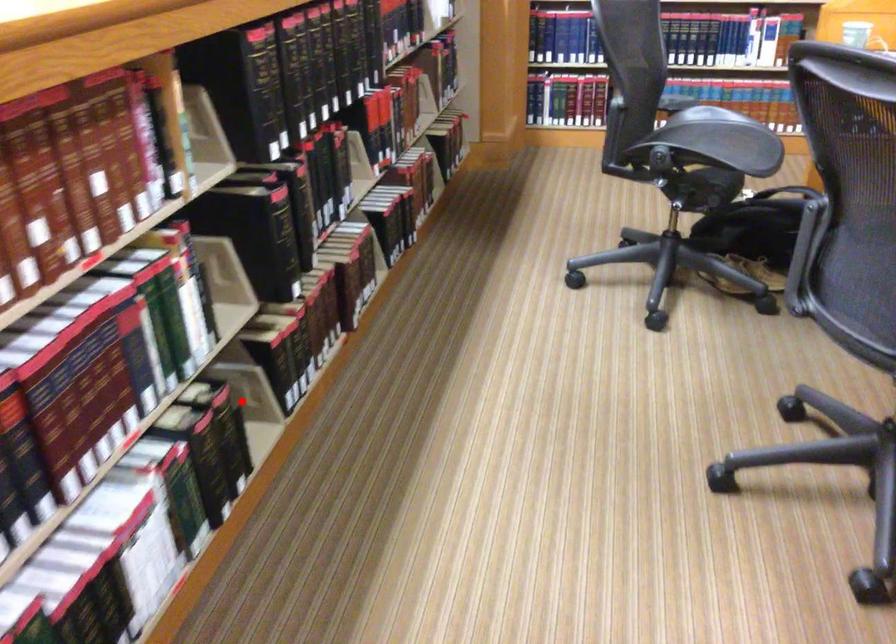
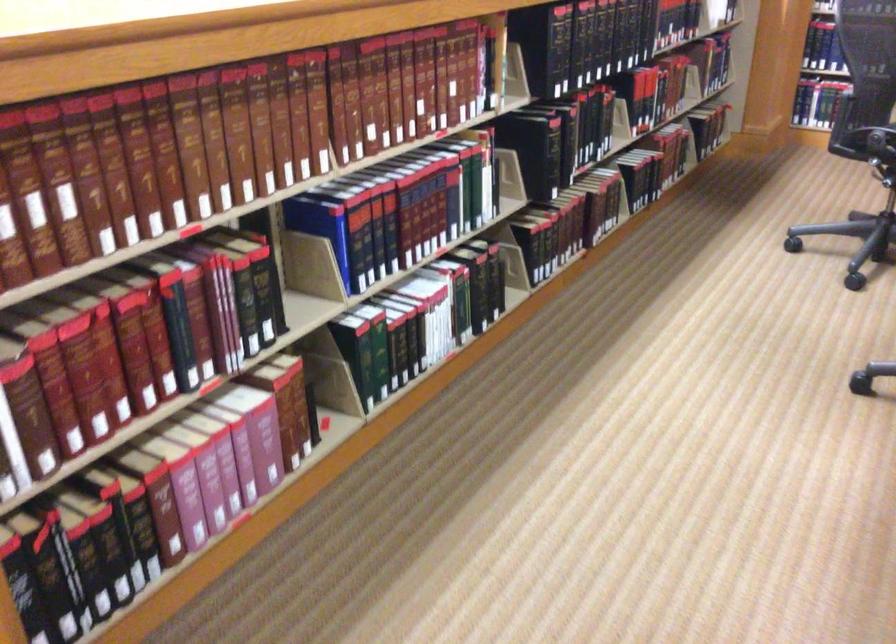
Question: I am providing you with two images of the same scene from different viewpoints. Given a red point in image1, look at the same physical point in image2. Is it:

Choices:
 (A) Closer to the viewpoint
 (B) Farther from the viewpoint

Answer: (B)